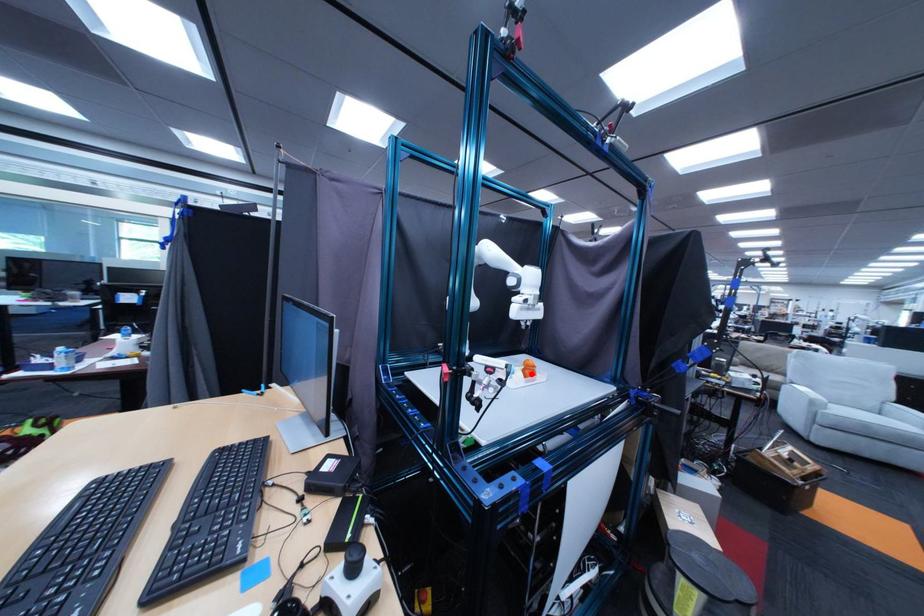
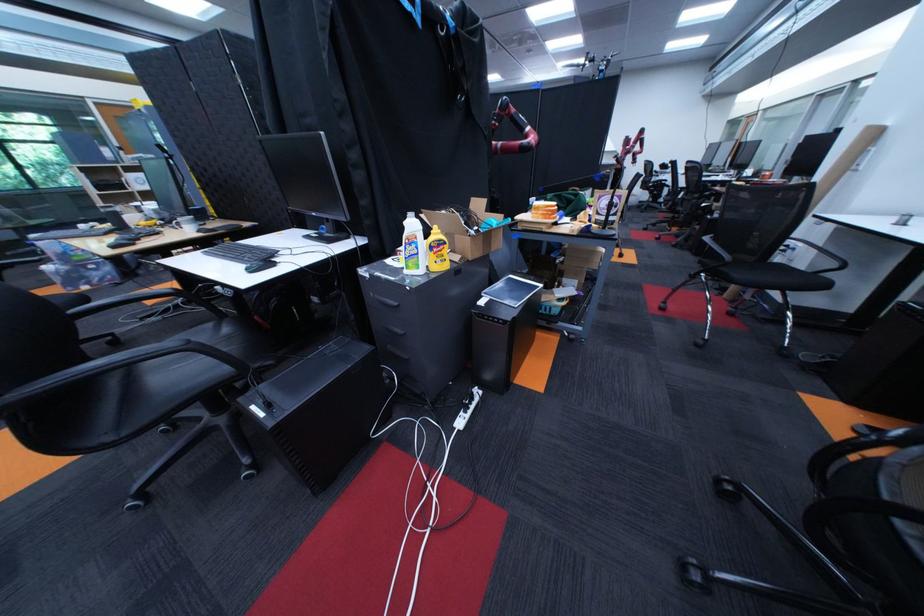
Question: I am providing you with two images of the same scene from different viewpoints. A red point is marked on the first image. Is the red point's position out of view in image 2?

Choices:
 (A) Yes
 (B) No

Answer: (A)